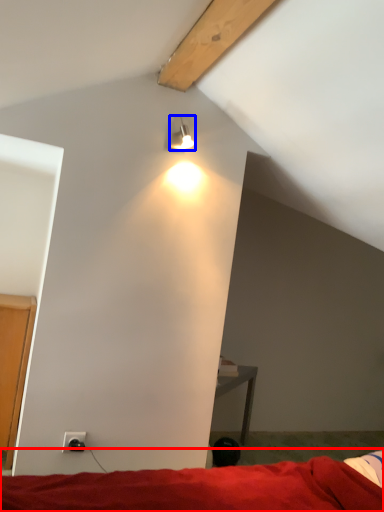
Question: Which object is closer to the camera taking this photo, bed (highlighted by a red box) or lamp (highlighted by a blue box)?

Choices:
 (A) bed
 (B) lamp

Answer: (A)